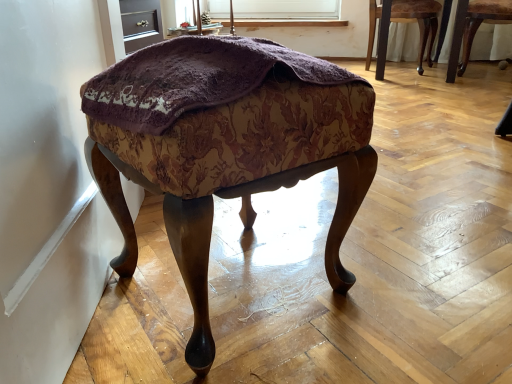
Question: Does velvet-like fabric stool at center lie in front of wooden chair at right, arranged as the 1th chair when viewed from the right?

Choices:
 (A) no
 (B) yes

Answer: (B)

Question: Can you confirm if velvet-like fabric stool at center is taller than wooden chair at right, arranged as the 1th chair when viewed from the right?

Choices:
 (A) yes
 (B) no

Answer: (A)

Question: From a real-world perspective, is velvet-like fabric stool at center beneath wooden chair at right, arranged as the 1th chair when viewed from the right?

Choices:
 (A) no
 (B) yes

Answer: (B)

Question: Does velvet-like fabric stool at center come behind wooden chair at right, arranged as the 1th chair when viewed from the right?

Choices:
 (A) no
 (B) yes

Answer: (A)

Question: Is velvet-like fabric stool at center smaller than wooden chair at right, marked as the second chair in a left-to-right arrangement?

Choices:
 (A) no
 (B) yes

Answer: (A)

Question: Does velvet-like fabric stool at center have a lesser width compared to wooden chair at right, marked as the second chair in a left-to-right arrangement?

Choices:
 (A) no
 (B) yes

Answer: (A)

Question: From the image's perspective, would you say wooden chair at upper right, the first chair viewed from the left, is positioned over velvet-like fabric stool at center?

Choices:
 (A) no
 (B) yes

Answer: (B)

Question: From a real-world perspective, does wooden chair at upper right, the first chair viewed from the left, stand above velvet-like fabric stool at center?

Choices:
 (A) no
 (B) yes

Answer: (B)

Question: Considering the relative sizes of wooden chair at upper right, which is counted as the 2th chair, starting from the right, and velvet-like fabric stool at center in the image provided, is wooden chair at upper right, which is counted as the 2th chair, starting from the right, taller than velvet-like fabric stool at center?

Choices:
 (A) no
 (B) yes

Answer: (B)

Question: Is wooden chair at upper right, the first chair viewed from the left, positioned in front of velvet-like fabric stool at center?

Choices:
 (A) no
 (B) yes

Answer: (A)

Question: Can you confirm if wooden chair at upper right, the first chair viewed from the left, is bigger than velvet-like fabric stool at center?

Choices:
 (A) no
 (B) yes

Answer: (B)

Question: Is velvet-like fabric stool at center at the back of wooden chair at upper right, which is counted as the 2th chair, starting from the right?

Choices:
 (A) no
 (B) yes

Answer: (A)

Question: Is wooden chair at upper right, the first chair viewed from the left, shorter than matte purple fabric at upper center?

Choices:
 (A) yes
 (B) no

Answer: (B)